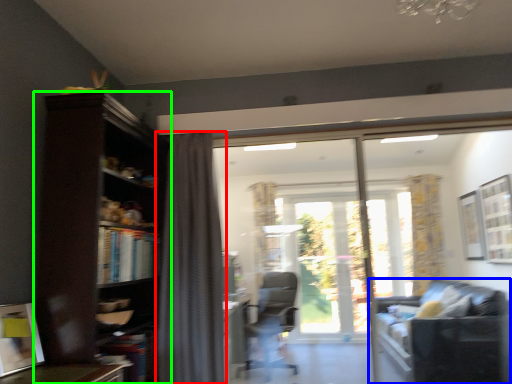
Question: Estimate the real-world distances between objects in this image. Which object is farther from curtain (highlighted by a red box), studio couch (highlighted by a blue box) or bookcase (highlighted by a green box)?

Choices:
 (A) studio couch
 (B) bookcase

Answer: (A)